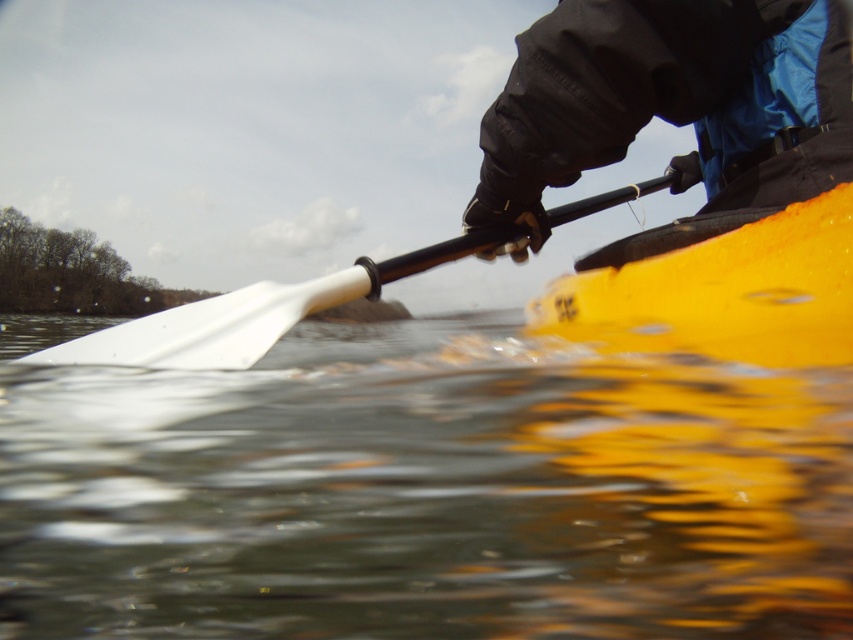
Question: Can you confirm if black waterproof jacket at upper right is positioned above yellow matte kayak at center?

Choices:
 (A) no
 (B) yes

Answer: (B)

Question: Which point is farther from the camera taking this photo?

Choices:
 (A) (103, 595)
 (B) (352, 269)

Answer: (B)

Question: Does transparent water at lower center have a greater width compared to white plastic paddle at center?

Choices:
 (A) yes
 (B) no

Answer: (A)

Question: Among these points, which one is farthest from the camera?

Choices:
 (A) (821, 45)
 (B) (560, 216)
 (C) (727, 353)
 (D) (93, 449)

Answer: (B)

Question: Which point appears farthest from the camera in this image?

Choices:
 (A) (726, 109)
 (B) (376, 275)
 (C) (718, 435)
 (D) (682, 288)

Answer: (B)

Question: Is transparent water at lower center positioned at the back of white plastic paddle at center?

Choices:
 (A) no
 (B) yes

Answer: (A)